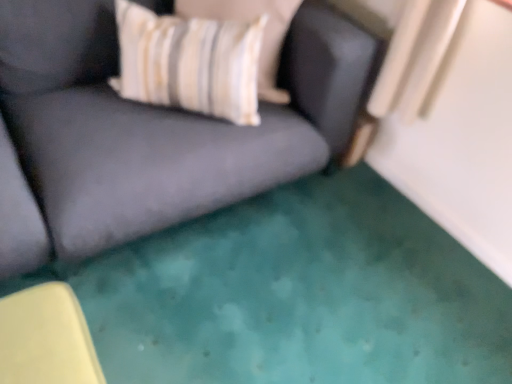
Question: Can you confirm if white striped fabric pillow at upper left is bigger than velvet dark gray couch at center?

Choices:
 (A) no
 (B) yes

Answer: (A)

Question: Is white striped fabric pillow at upper left outside velvet dark gray couch at center?

Choices:
 (A) yes
 (B) no

Answer: (B)

Question: Could you tell me if white striped fabric pillow at upper left is turned towards velvet dark gray couch at center?

Choices:
 (A) no
 (B) yes

Answer: (B)

Question: Is white striped fabric pillow at upper left positioned far away from velvet dark gray couch at center?

Choices:
 (A) no
 (B) yes

Answer: (A)

Question: Considering the relative sizes of white striped fabric pillow at upper left and velvet dark gray couch at center in the image provided, is white striped fabric pillow at upper left smaller than velvet dark gray couch at center?

Choices:
 (A) no
 (B) yes

Answer: (B)

Question: From a real-world perspective, is striped fabric pillow at upper center above or below velvet dark gray couch at center?

Choices:
 (A) above
 (B) below

Answer: (A)

Question: From their relative heights in the image, would you say striped fabric pillow at upper center is taller or shorter than velvet dark gray couch at center?

Choices:
 (A) tall
 (B) short

Answer: (B)

Question: Considering the positions of point (229, 8) and point (90, 134), is point (229, 8) closer or farther from the camera than point (90, 134)?

Choices:
 (A) farther
 (B) closer

Answer: (A)

Question: Based on their sizes in the image, would you say striped fabric pillow at upper center is bigger or smaller than velvet dark gray couch at center?

Choices:
 (A) small
 (B) big

Answer: (A)

Question: Looking at the image, does velvet dark gray couch at center seem bigger or smaller compared to white striped fabric pillow at upper left?

Choices:
 (A) small
 (B) big

Answer: (B)

Question: Choose the correct answer: Is velvet dark gray couch at center inside white striped fabric pillow at upper left or outside it?

Choices:
 (A) inside
 (B) outside

Answer: (B)

Question: Looking at their shapes, would you say velvet dark gray couch at center is wider or thinner than white striped fabric pillow at upper left?

Choices:
 (A) wide
 (B) thin

Answer: (A)

Question: From a real-world perspective, is velvet dark gray couch at center physically located above or below white striped fabric pillow at upper left?

Choices:
 (A) above
 (B) below

Answer: (B)

Question: Is striped fabric pillow at upper center wider or thinner than white striped fabric pillow at upper left?

Choices:
 (A) wide
 (B) thin

Answer: (B)

Question: From the image's perspective, relative to white striped fabric pillow at upper left, is striped fabric pillow at upper center above or below?

Choices:
 (A) above
 (B) below

Answer: (A)